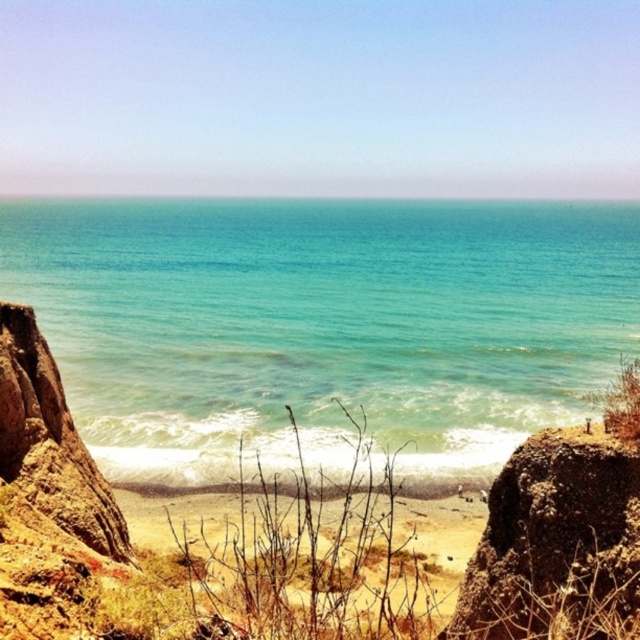
You are standing at the cliff edge overlooking the beach and ocean. You see the brown rough rock at lower right and the clear blue water at center. Which object is closer to you based on their positions?

The brown rough rock at lower right is closer to you because it is positioned behind the clear blue water at center, meaning the water is between you and the rock.

You are standing at the top of the cliffs looking down at the clear blue water at center and the brown rough rock at lower right. Which object is closer to the base of the cliffs?

The brown rough rock at lower right is closer to the base of the cliffs because it is positioned under the clear blue water at center.